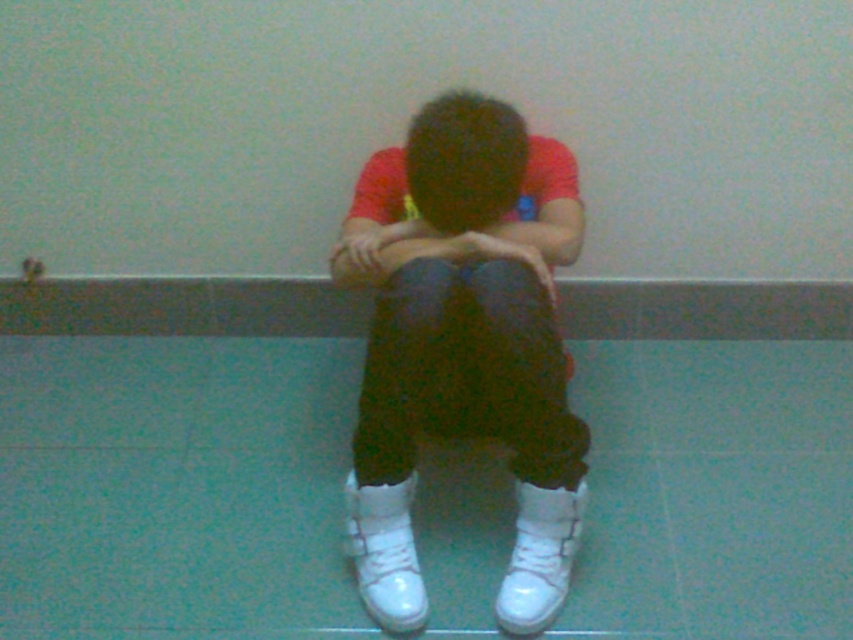
You are an interior designer assessing the space where the person is sitting. You need to place a small rug between the white leather shoes at center and the dark brown hair at center. Which object should the rug be closer to to ensure it doesn

The rug should be placed closer to the dark brown hair at center because the white leather shoes at center might be wider than the dark brown hair at center, making the hair area narrower and requiring the rug to be positioned there for better fit.